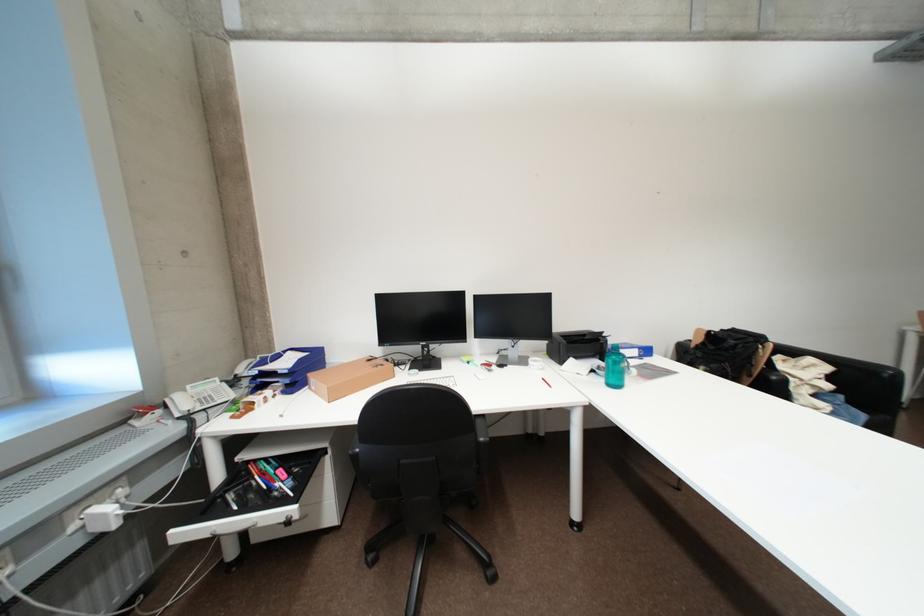
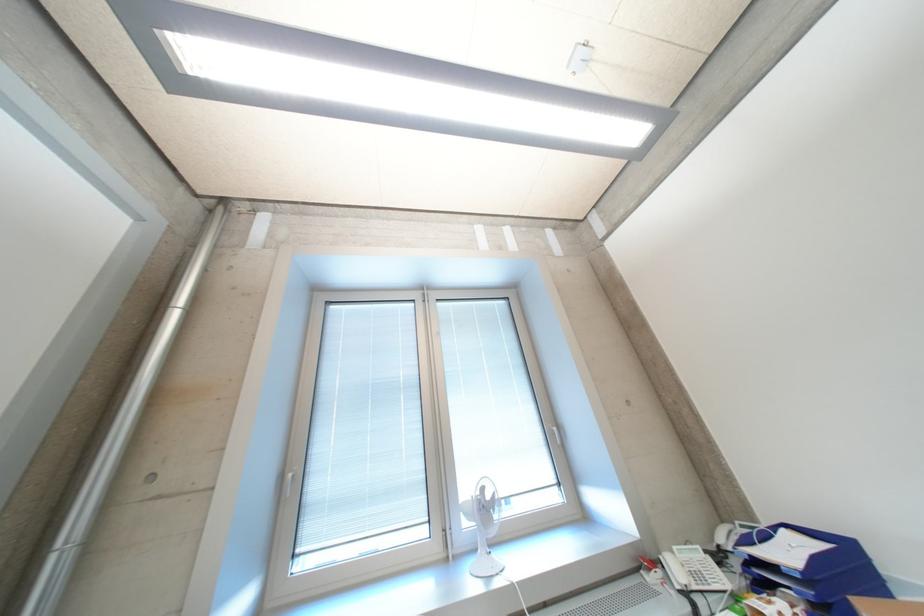
First-person continuous shooting, in which direction is the camera rotating?

The rotation direction of the camera is left-up.